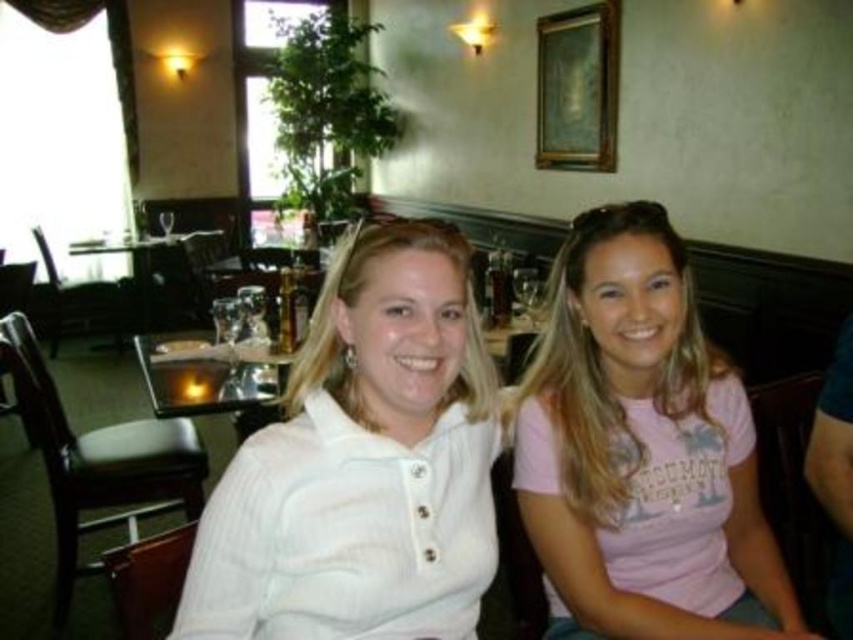
Question: Among these points, which one is nearest to the camera?

Choices:
 (A) (300, 348)
 (B) (585, 285)

Answer: (B)

Question: Is white ribbed polo shirt at center bigger than wooden table at center?

Choices:
 (A) yes
 (B) no

Answer: (B)

Question: Does pink cotton shirt at center appear under wooden table at center?

Choices:
 (A) yes
 (B) no

Answer: (A)

Question: Which is farther from the wooden table at center?

Choices:
 (A) pink cotton shirt at center
 (B) white ribbed polo shirt at center

Answer: (A)

Question: Is pink cotton shirt at center to the left of wooden table at center from the viewer's perspective?

Choices:
 (A) no
 (B) yes

Answer: (A)

Question: Which point is farther to the camera?

Choices:
 (A) (578, 490)
 (B) (436, 600)
 (C) (161, 244)

Answer: (C)